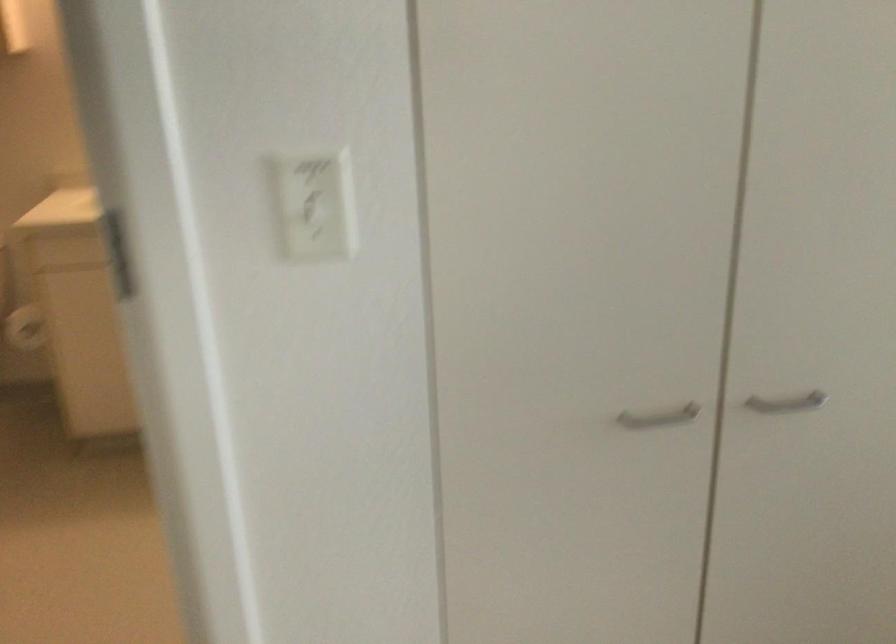
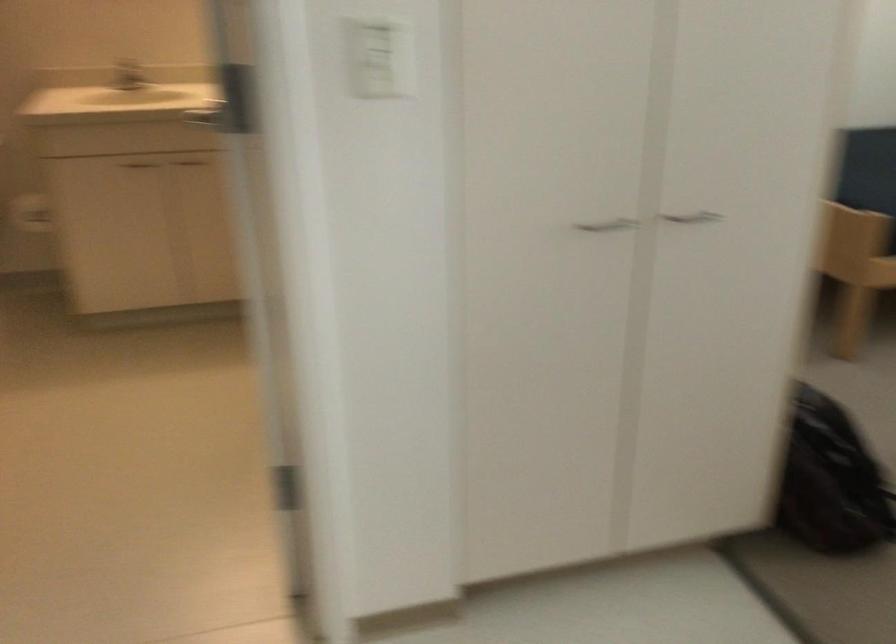
Question: In a continuous first-person perspective shot, in which direction is the camera moving?

Choices:
 (A) Left
 (B) Right
 (C) Forward
 (D) Backward

Answer: (D)